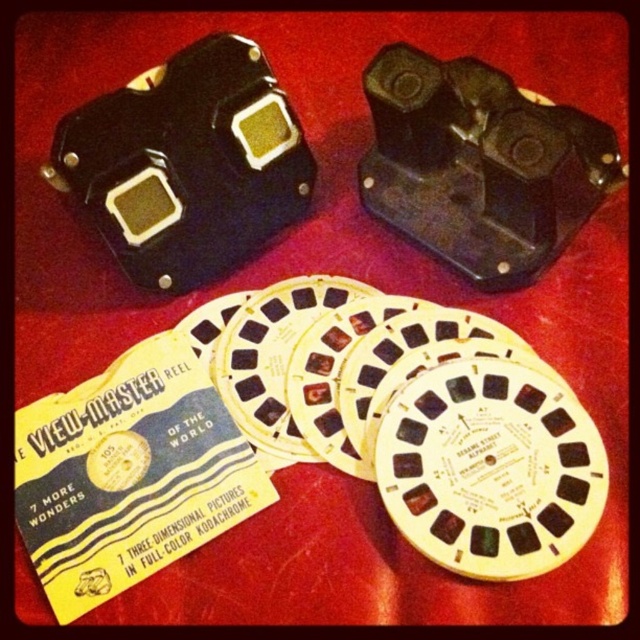
Question: Estimate the real-world distances between objects in this image. Which object is closer to the yellow paper card at upper left?

Choices:
 (A) black plastic camera at upper center
 (B) black plastic camera at upper left

Answer: (B)

Question: Can you confirm if black plastic camera at upper left is wider than black plastic camera at upper center?

Choices:
 (A) no
 (B) yes

Answer: (B)

Question: Is yellow paper card at upper left further to the viewer compared to black plastic camera at upper center?

Choices:
 (A) yes
 (B) no

Answer: (B)

Question: Among these objects, which one is farthest from the camera?

Choices:
 (A) black plastic camera at upper left
 (B) black plastic camera at upper center
 (C) yellow paper card at upper left

Answer: (A)

Question: Which of the following is the closest to the observer?

Choices:
 (A) (76, 465)
 (B) (259, 81)

Answer: (A)

Question: Does black plastic camera at upper left appear under black plastic camera at upper center?

Choices:
 (A) yes
 (B) no

Answer: (B)